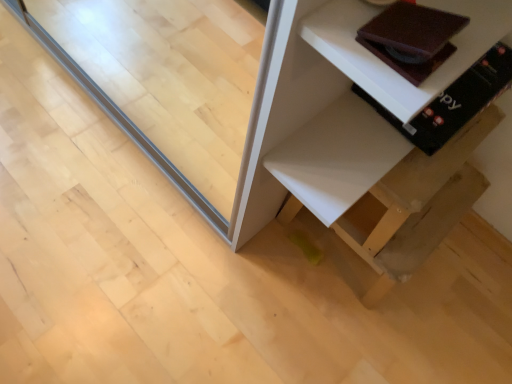
What is the approximate height of brown leather book at upper right, placed as the 1th book when sorted from back to front?

It is 3.82 inches.

You are a GUI agent. You are given a task and a screenshot of the screen. Output one action in this format:
    pyautogui.click(x=<x>, y=<y>)
    Task: Click on the transparent glass door at center
    
    Given the screenshot: What is the action you would take?
    pyautogui.click(x=170, y=83)

From a real-world perspective, is brown leather book at upper right, the 2th book viewed from the front, physically below matte brown book at upper right, which appears as the 1th book when viewed from the front?

Yes.

Considering the relative positions of brown leather book at upper right, the 2th book viewed from the front, and matte brown book at upper right, which appears as the 1th book when viewed from the front, in the image provided, is brown leather book at upper right, the 2th book viewed from the front, to the left of matte brown book at upper right, which appears as the 1th book when viewed from the front, from the viewer's perspective?

No, brown leather book at upper right, the 2th book viewed from the front, is not to the left of matte brown book at upper right, which appears as the 1th book when viewed from the front.

Which of these two, brown leather book at upper right, the 2th book viewed from the front, or matte brown book at upper right, which appears as the second book when viewed from the back, is bigger?

Bigger between the two is brown leather book at upper right, the 2th book viewed from the front.

From the image's perspective, is brown leather book at upper right, the 2th book viewed from the front, positioned above or below matte brown book at upper right, which appears as the 1th book when viewed from the front?

From the image's perspective, brown leather book at upper right, the 2th book viewed from the front, appears above matte brown book at upper right, which appears as the 1th book when viewed from the front.

Is transparent glass door at center oriented towards brown leather book at upper right, placed as the 1th book when sorted from back to front?

No, transparent glass door at center is not aimed at brown leather book at upper right, placed as the 1th book when sorted from back to front.

Which of these two, transparent glass door at center or brown leather book at upper right, placed as the 1th book when sorted from back to front, is smaller?

brown leather book at upper right, placed as the 1th book when sorted from back to front.

Identify the location of glass door located above the brown leather book at upper right, placed as the 1th book when sorted from back to front (from the image's perspective). (170, 83).

Considering the positions of points (167, 57) and (384, 116), is point (167, 57) farther from camera compared to point (384, 116)?

Yes.

Which is farther, (413, 2) or (329, 128)?

The point (329, 128) is behind.

Considering the relative sizes of matte brown book at upper right, which appears as the 1th book when viewed from the front, and white matte shelf at lower right in the image provided, is matte brown book at upper right, which appears as the 1th book when viewed from the front, thinner than white matte shelf at lower right?

Yes.

From the image's perspective, is matte brown book at upper right, which appears as the second book when viewed from the back, under white matte shelf at lower right?

No, from the image's perspective, matte brown book at upper right, which appears as the second book when viewed from the back, is not below white matte shelf at lower right.

Does matte brown book at upper right, which appears as the 1th book when viewed from the front, have a greater height compared to brown leather book at upper right, placed as the 1th book when sorted from back to front?

In fact, matte brown book at upper right, which appears as the 1th book when viewed from the front, may be shorter than brown leather book at upper right, placed as the 1th book when sorted from back to front.

Is matte brown book at upper right, which appears as the 1th book when viewed from the front, positioned with its back to brown leather book at upper right, the 2th book viewed from the front?

No, matte brown book at upper right, which appears as the 1th book when viewed from the front, is not facing the opposite direction of brown leather book at upper right, the 2th book viewed from the front.

Does matte brown book at upper right, which appears as the 1th book when viewed from the front, come in front of brown leather book at upper right, the 2th book viewed from the front?

Yes, matte brown book at upper right, which appears as the 1th book when viewed from the front, is in front of brown leather book at upper right, the 2th book viewed from the front.

From a real-world perspective, is matte brown book at upper right, which appears as the 1th book when viewed from the front, positioned above or below brown leather book at upper right, placed as the 1th book when sorted from back to front?

Clearly, from a real-world perspective, matte brown book at upper right, which appears as the 1th book when viewed from the front, is above brown leather book at upper right, placed as the 1th book when sorted from back to front.

Which is more to the left, brown leather book at upper right, placed as the 1th book when sorted from back to front, or white matte shelf at lower right?

From the viewer's perspective, white matte shelf at lower right appears more on the left side.

Is brown leather book at upper right, placed as the 1th book when sorted from back to front, in front of white matte shelf at lower right?

That is False.

What's the angular difference between brown leather book at upper right, the 2th book viewed from the front, and white matte shelf at lower right's facing directions?

The facing directions of brown leather book at upper right, the 2th book viewed from the front, and white matte shelf at lower right are 8.2 degrees apart.

Is transparent glass door at center a part of white matte shelf at lower right?

No.

Considering the relative positions of white matte shelf at lower right and transparent glass door at center in the image provided, is white matte shelf at lower right behind transparent glass door at center?

Yes.

Measure the distance between white matte shelf at lower right and transparent glass door at center.

They are 18.31 inches apart.

Is white matte shelf at lower right far away from transparent glass door at center?

white matte shelf at lower right is near transparent glass door at center, not far away.

Which object is further away from the camera taking this photo, transparent glass door at center or white matte shelf at lower right?

white matte shelf at lower right is further away from the camera.

Are transparent glass door at center and white matte shelf at lower right located far from each other?

No, there isn't a large distance between transparent glass door at center and white matte shelf at lower right.

In the image, is transparent glass door at center on the left side or the right side of white matte shelf at lower right?

Clearly, transparent glass door at center is on the left of white matte shelf at lower right in the image.

You are a GUI agent. You are given a task and a screenshot of the screen. Output one action in this format:
    pyautogui.click(x=<x>, y=<y>)
    Task: Click on the book on the right of matte brown book at upper right, which appears as the 1th book when viewed from the front
    
    Given the screenshot: What is the action you would take?
    pyautogui.click(x=453, y=101)

Find the location of a particular element. the 1st book positioned below the transparent glass door at center (from the image's perspective) is located at coordinates (453, 101).

Based on their spatial positions, is white matte shelf at lower right or matte brown book at upper right, which appears as the second book when viewed from the back, further from transparent glass door at center?

matte brown book at upper right, which appears as the second book when viewed from the back, lies further to transparent glass door at center than the other object.

Looking at the image, which one is located closer to brown leather book at upper right, the 2th book viewed from the front, white matte shelf at lower right or matte brown book at upper right, which appears as the 1th book when viewed from the front?

white matte shelf at lower right is positioned closer to the anchor brown leather book at upper right, the 2th book viewed from the front.

From the image, which object appears to be farther from brown leather book at upper right, placed as the 1th book when sorted from back to front, matte brown book at upper right, which appears as the second book when viewed from the back, or white matte shelf at lower right?

matte brown book at upper right, which appears as the second book when viewed from the back, lies further to brown leather book at upper right, placed as the 1th book when sorted from back to front, than the other object.

Looking at this image, when comparing their distances from matte brown book at upper right, which appears as the 1th book when viewed from the front, does transparent glass door at center or white matte shelf at lower right seem further?

Among the two, transparent glass door at center is located further to matte brown book at upper right, which appears as the 1th book when viewed from the front.

From the picture: Estimate the real-world distances between objects in this image. Which object is closer to transparent glass door at center, matte brown book at upper right, which appears as the second book when viewed from the back, or brown leather book at upper right, placed as the 1th book when sorted from back to front?

The object closer to transparent glass door at center is brown leather book at upper right, placed as the 1th book when sorted from back to front.

Considering their positions, is matte brown book at upper right, which appears as the 1th book when viewed from the front, positioned closer to white matte shelf at lower right than transparent glass door at center?

Among the two, matte brown book at upper right, which appears as the 1th book when viewed from the front, is located nearer to white matte shelf at lower right.

Based on their spatial positions, is matte brown book at upper right, which appears as the second book when viewed from the back, or brown leather book at upper right, the 2th book viewed from the front, further from white matte shelf at lower right?

matte brown book at upper right, which appears as the second book when viewed from the back, lies further to white matte shelf at lower right than the other object.

Considering their positions, is transparent glass door at center positioned closer to white matte shelf at lower right than matte brown book at upper right, which appears as the second book when viewed from the back?

Among the two, matte brown book at upper right, which appears as the second book when viewed from the back, is located nearer to white matte shelf at lower right.

Identify the location of furniture between matte brown book at upper right, which appears as the 1th book when viewed from the front, and brown leather book at upper right, placed as the 1th book when sorted from back to front, along the z-axis. The width and height of the screenshot is (512, 384). (349, 161).

The image size is (512, 384). Find the location of `book between transparent glass door at center and brown leather book at upper right, the 2th book viewed from the front`. book between transparent glass door at center and brown leather book at upper right, the 2th book viewed from the front is located at coordinates (411, 38).

Locate an element on the screen. The image size is (512, 384). furniture located between transparent glass door at center and brown leather book at upper right, placed as the 1th book when sorted from back to front, in the left-right direction is located at coordinates (349, 161).

In order to click on book between transparent glass door at center and white matte shelf at lower right from left to right in this screenshot , I will do `click(411, 38)`.